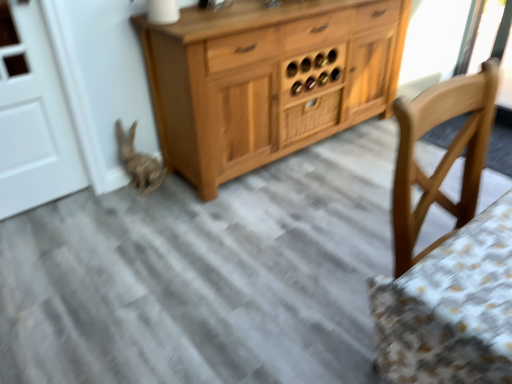
Question: Can you confirm if wooden drawer at center is shorter than bleached wood rabbit at lower left?

Choices:
 (A) no
 (B) yes

Answer: (B)

Question: Does wooden drawer at center have a larger size compared to bleached wood rabbit at lower left?

Choices:
 (A) no
 (B) yes

Answer: (A)

Question: From a real-world perspective, is wooden drawer at center over bleached wood rabbit at lower left?

Choices:
 (A) no
 (B) yes

Answer: (B)

Question: Does wooden drawer at center have a greater width compared to bleached wood rabbit at lower left?

Choices:
 (A) yes
 (B) no

Answer: (B)

Question: Is wooden drawer at center further to camera compared to bleached wood rabbit at lower left?

Choices:
 (A) no
 (B) yes

Answer: (B)

Question: Is wooden drawer at center next to bleached wood rabbit at lower left?

Choices:
 (A) yes
 (B) no

Answer: (B)

Question: Is wooden drawer at center at the back of bleached wood rabbit at lower left?

Choices:
 (A) no
 (B) yes

Answer: (A)

Question: Can you confirm if bleached wood rabbit at lower left is positioned to the left of wooden drawer at center?

Choices:
 (A) no
 (B) yes

Answer: (B)

Question: Can you confirm if bleached wood rabbit at lower left is thinner than wooden drawer at center?

Choices:
 (A) no
 (B) yes

Answer: (A)

Question: From the image's perspective, is bleached wood rabbit at lower left beneath wooden drawer at center?

Choices:
 (A) yes
 (B) no

Answer: (A)

Question: Is bleached wood rabbit at lower left wider than wooden drawer at center?

Choices:
 (A) yes
 (B) no

Answer: (A)

Question: Does bleached wood rabbit at lower left come in front of wooden drawer at center?

Choices:
 (A) yes
 (B) no

Answer: (A)

Question: Is bleached wood rabbit at lower left inside or outside of wooden drawer at center?

Choices:
 (A) inside
 (B) outside

Answer: (B)